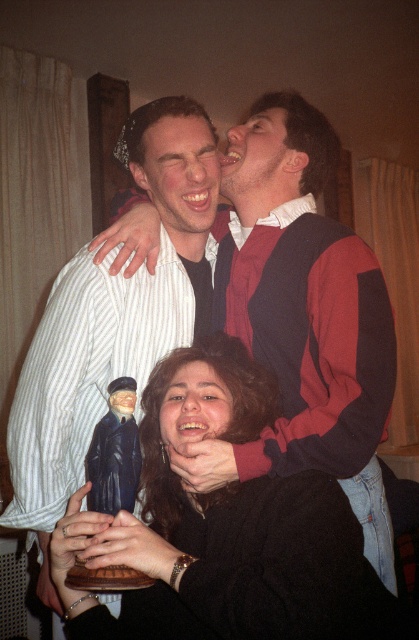
Looking at this image, does matte black sweater at center have a lesser width compared to matte red sweater at upper center?

No.

Does matte black sweater at center appear over matte red sweater at upper center?

No.

Who is more distant from viewer, [315,252] or [256,193]?

The point [256,193] is behind.

I want to click on matte black sweater at center, so click(x=308, y=337).

Which is below, matte white face at center or smooth skin face at center?

smooth skin face at center

Can you confirm if matte white face at center is positioned above smooth skin face at center?

Yes.

You are a GUI agent. You are given a task and a screenshot of the screen. Output one action in this format:
    pyautogui.click(x=<x>, y=<y>)
    Task: Click on the matte white face at center
    
    Given the screenshot: What is the action you would take?
    pyautogui.click(x=181, y=177)

Is matte black figurine at center positioned before matte red sweater at upper center?

That is True.

Does matte black figurine at center come behind matte red sweater at upper center?

No.

You are a GUI agent. You are given a task and a screenshot of the screen. Output one action in this format:
    pyautogui.click(x=<x>, y=<y>)
    Task: Click on the matte black figurine at center
    The height and width of the screenshot is (640, 419).
    Given the screenshot: What is the action you would take?
    pyautogui.click(x=217, y=525)

Find the location of a particular element. This screenshot has width=419, height=640. matte black figurine at center is located at coordinates pyautogui.click(x=217, y=525).